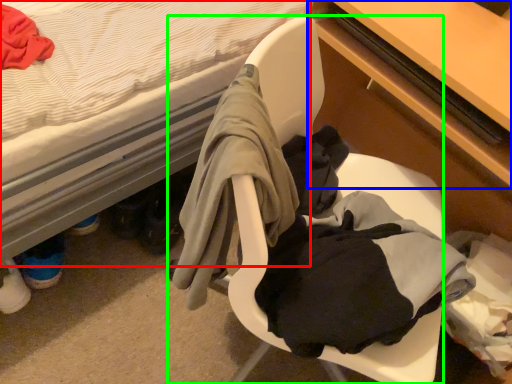
Question: Which is farther away from bed (highlighted by a red box)? table (highlighted by a blue box) or chair (highlighted by a green box)?

Choices:
 (A) table
 (B) chair

Answer: (A)